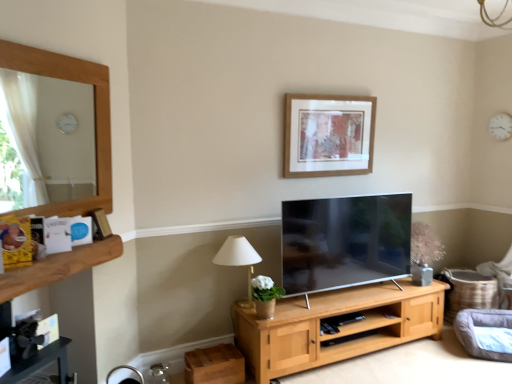
I want to click on white fabric lampshade at lower center, so click(239, 260).

Is point (502, 135) more distant than point (22, 292)?

Yes.

Can you see white plastic clock at upper right touching brown wooden shelf at left?

white plastic clock at upper right is not next to brown wooden shelf at left, and they're not touching.

Is white plastic clock at upper right spatially inside brown wooden shelf at left, or outside of it?

white plastic clock at upper right is not inside brown wooden shelf at left, it's outside.

Can you confirm if white fabric lampshade at lower center is positioned to the left of gray fabric swivel chair at lower right?

Yes.

From a real-world perspective, is white fabric lampshade at lower center physically located above or below gray fabric swivel chair at lower right?

white fabric lampshade at lower center is situated higher than gray fabric swivel chair at lower right in the real world.

From the image's perspective, is white fabric lampshade at lower center located above or below gray fabric swivel chair at lower right?

Clearly, from the image's perspective, white fabric lampshade at lower center is above gray fabric swivel chair at lower right.

Locate an element on the screen. Image resolution: width=512 pixels, height=384 pixels. swivel chair below the white fabric lampshade at lower center (from the image's perspective) is located at coordinates (483, 327).

Is gray fabric swivel chair at lower right next to brushed metal fireplace at lower left and touching it?

No.

From a real-world perspective, which is physically above, gray fabric swivel chair at lower right or brushed metal fireplace at lower left?

brushed metal fireplace at lower left, from a real-world perspective.

Which is closer, (492, 352) or (46, 270)?

Point (492, 352) is farther from the camera than point (46, 270).

Is gray fabric swivel chair at lower right positioned before brushed metal fireplace at lower left?

That is False.

Consider the image. Is white fabric lampshade at lower center in front of or behind brushed metal fireplace at lower left in the image?

Clearly, white fabric lampshade at lower center is behind brushed metal fireplace at lower left.

Between point (249, 267) and point (3, 295), which one is positioned in front?

The point (3, 295) is closer.

You are a GUI agent. You are given a task and a screenshot of the screen. Output one action in this format:
    pyautogui.click(x=<x>, y=<y>)
    Task: Click on the table lamp to the right of brushed metal fireplace at lower left
    The image size is (512, 384).
    Given the screenshot: What is the action you would take?
    pyautogui.click(x=239, y=260)

Does white fabric lampshade at lower center contain brushed metal fireplace at lower left?

That's incorrect, brushed metal fireplace at lower left is not inside white fabric lampshade at lower center.

Is wooden picture frame at upper center to the left of brown wooden shelf at left from the viewer's perspective?

No.

Between wooden picture frame at upper center and brown wooden shelf at left, which one has smaller size?

brown wooden shelf at left is smaller.

Identify the location of picture frame behind the brown wooden shelf at left. (328, 135).

What's the angular difference between white fabric lampshade at lower center and white plastic clock at upper right's facing directions?

white fabric lampshade at lower center and white plastic clock at upper right are facing 90 degrees away from each other.

Considering the relative sizes of white fabric lampshade at lower center and white plastic clock at upper right in the image provided, is white fabric lampshade at lower center thinner than white plastic clock at upper right?

Incorrect, the width of white fabric lampshade at lower center is not less than that of white plastic clock at upper right.

How distant is white fabric lampshade at lower center from white plastic clock at upper right?

white fabric lampshade at lower center is 2.70 meters away from white plastic clock at upper right.

From a real-world perspective, which object stands above the other?

white plastic clock at upper right is physically above.

The image size is (512, 384). I want to click on clock that appears on the right of white fabric lampshade at lower center, so click(501, 126).

Who is shorter, white plastic clock at upper right or white fabric lampshade at lower center?

white plastic clock at upper right is shorter.

Is white plastic clock at upper right oriented towards white fabric lampshade at lower center?

Yes, white plastic clock at upper right is aimed at white fabric lampshade at lower center.

Can you confirm if white plastic clock at upper right is thinner than white fabric lampshade at lower center?

Correct, the width of white plastic clock at upper right is less than that of white fabric lampshade at lower center.

Identify the location of clock that appears above the brown wooden shelf at left (from the image's perspective). (501, 126).

At what (x,y) coordinates should I click in order to perform the action: click on swivel chair below the white fabric lampshade at lower center (from a real-world perspective). Please return your answer as a coordinate pair (x, y). Looking at the image, I should click on (483, 327).

When comparing their distances from white plastic clock at upper right, does wooden picture frame at upper center or brown wooden shelf at left seem closer?

wooden picture frame at upper center lies closer to white plastic clock at upper right than the other object.

Estimate the real-world distances between objects in this image. Which object is further from brown wooden shelf at left, white fabric lampshade at lower center or white plastic clock at upper right?

Among the two, white plastic clock at upper right is located further to brown wooden shelf at left.

Estimate the real-world distances between objects in this image. Which object is closer to white fabric lampshade at lower center, white plastic clock at upper right or brushed metal fireplace at lower left?

Based on the image, brushed metal fireplace at lower left appears to be nearer to white fabric lampshade at lower center.

Considering their positions, is white fabric lampshade at lower center positioned closer to white plastic clock at upper right than brown wooden shelf at left?

white fabric lampshade at lower center lies closer to white plastic clock at upper right than the other object.

Estimate the real-world distances between objects in this image. Which object is closer to gray fabric swivel chair at lower right, brown wooden shelf at left or white fabric lampshade at lower center?

white fabric lampshade at lower center.

Which object lies nearer to the anchor point brown wooden shelf at left, gray fabric swivel chair at lower right or white fabric lampshade at lower center?

white fabric lampshade at lower center is positioned closer to the anchor brown wooden shelf at left.

Based on their spatial positions, is brushed metal fireplace at lower left or gray fabric swivel chair at lower right further from brown wooden shelf at left?

Among the two, gray fabric swivel chair at lower right is located further to brown wooden shelf at left.

Estimate the real-world distances between objects in this image. Which object is closer to white plastic clock at upper right, white fabric lampshade at lower center or gray fabric swivel chair at lower right?

Answer: gray fabric swivel chair at lower right is closer to white plastic clock at upper right.

The image size is (512, 384). Find the location of `swivel chair between brown wooden shelf at left and white plastic clock at upper right in the horizontal direction`. swivel chair between brown wooden shelf at left and white plastic clock at upper right in the horizontal direction is located at coordinates (483, 327).

This screenshot has width=512, height=384. Find the location of `picture frame between brushed metal fireplace at lower left and gray fabric swivel chair at lower right from left to right`. picture frame between brushed metal fireplace at lower left and gray fabric swivel chair at lower right from left to right is located at coordinates (328, 135).

Where is `shelf between brushed metal fireplace at lower left and wooden picture frame at upper center`? Image resolution: width=512 pixels, height=384 pixels. shelf between brushed metal fireplace at lower left and wooden picture frame at upper center is located at coordinates (58, 267).

What are the coordinates of `shelf situated between brushed metal fireplace at lower left and gray fabric swivel chair at lower right from left to right` in the screenshot? It's located at (58, 267).